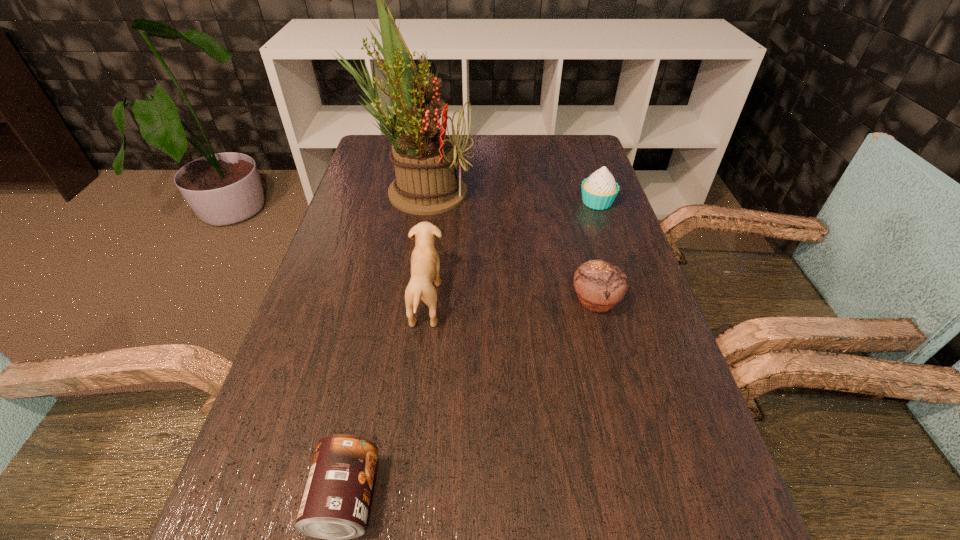
You are a GUI agent. You are given a task and a screenshot of the screen. Output one action in this format:
    pyautogui.click(x=<x>, y=<y>)
    Task: Click on the free spot that satisfies the following two spatial constraints: 1. in front of the cupcake with the fan visible; 2. on the right side of the flower arrangement
    The width and height of the screenshot is (960, 540).
    Given the screenshot: What is the action you would take?
    pyautogui.click(x=417, y=202)

Locate an element on the screen. The height and width of the screenshot is (540, 960). vacant space that satisfies the following two spatial constraints: 1. in front of the cupcake with the fan visible; 2. on the right side of the flower arrangement is located at coordinates (x=417, y=202).

This screenshot has width=960, height=540. Identify the location of free space that satisfies the following two spatial constraints: 1. on the left side of the puppy; 2. on the left side of the muffin. (426, 301).

You are a GUI agent. You are given a task and a screenshot of the screen. Output one action in this format:
    pyautogui.click(x=<x>, y=<y>)
    Task: Click on the vacant space that satisfies the following two spatial constraints: 1. in front of the cupcake with the fan visible; 2. on the right side of the flower arrangement
    Image resolution: width=960 pixels, height=540 pixels.
    Given the screenshot: What is the action you would take?
    pyautogui.click(x=417, y=202)